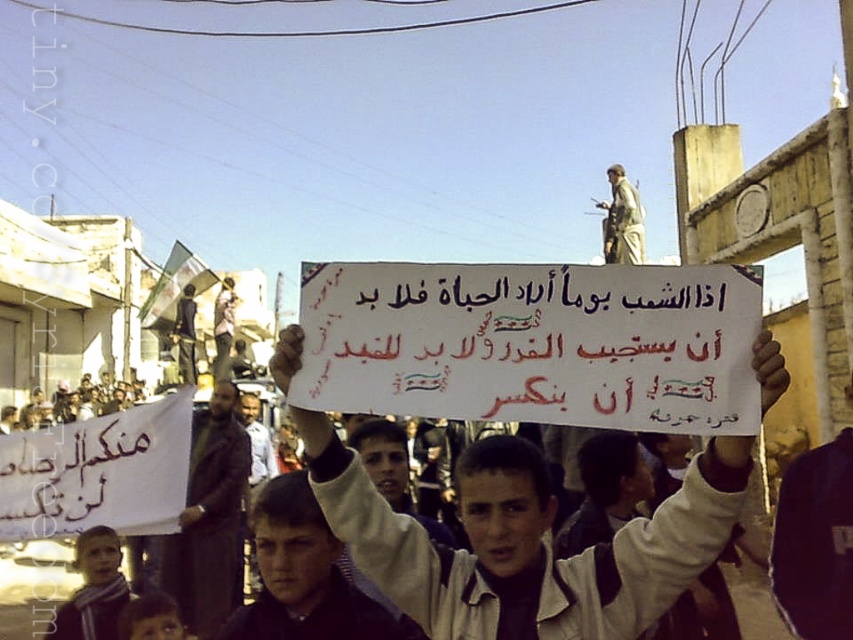
Question: In this image, where is light brown hair at center located relative to light brown scarf at lower left?

Choices:
 (A) left
 (B) right

Answer: (B)

Question: Which is farther from the white paper placard at center?

Choices:
 (A) dark brown leather jacket at lower left
 (B) light brown hair at center
 (C) light brown scarf at lower left
 (D) white cotton shirt at center

Answer: (A)

Question: In this image, where is light brown hair at center located relative to dark brown leather jacket at lower left?

Choices:
 (A) right
 (B) left

Answer: (A)

Question: Which object is closer to the camera taking this photo?

Choices:
 (A) dark brown leather jacket at lower left
 (B) light brown hair at center
 (C) white cotton shirt at center

Answer: (C)

Question: Can you confirm if white cotton shirt at center is positioned above light brown hair at center?

Choices:
 (A) yes
 (B) no

Answer: (A)

Question: Which is nearer to the light brown scarf at lower left?

Choices:
 (A) white cotton shirt at center
 (B) light brown hair at center
 (C) dark brown leather jacket at lower left

Answer: (C)